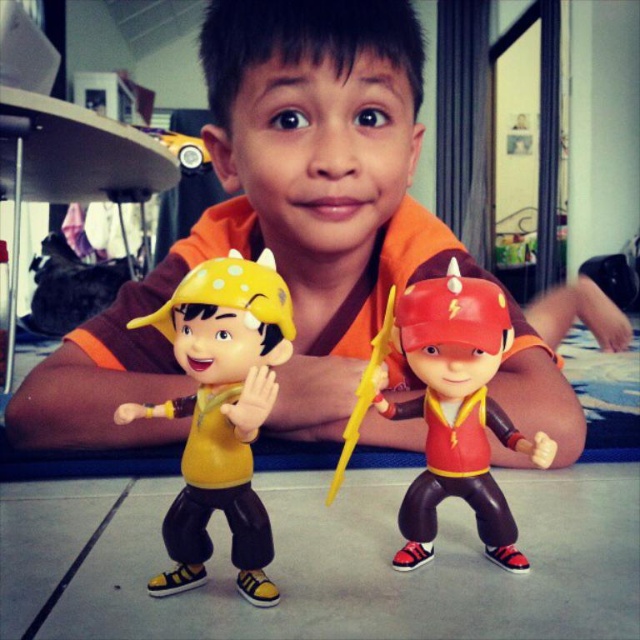
Question: Which point is farther from the camera taking this photo?

Choices:
 (A) (522, 445)
 (B) (369, 396)
 (C) (234, 282)
 (D) (248, 132)

Answer: (D)

Question: Which point is farther to the camera?

Choices:
 (A) yellow plastic sword at center
 (B) yellow matte toy at center
 (C) matte yellow plastic toy at lower left
 (D) matte red plastic toy at center

Answer: (C)

Question: Which point is closer to the camera taking this photo?

Choices:
 (A) (257, 403)
 (B) (520, 337)
 (C) (493, 424)

Answer: (A)

Question: Is matte yellow plastic toy at lower left above matte red plastic toy at center?

Choices:
 (A) yes
 (B) no

Answer: (A)

Question: Does yellow matte toy at center lie in front of yellow plastic sword at center?

Choices:
 (A) yes
 (B) no

Answer: (A)

Question: Can you confirm if matte yellow plastic toy at lower left is smaller than matte red plastic toy at center?

Choices:
 (A) yes
 (B) no

Answer: (B)